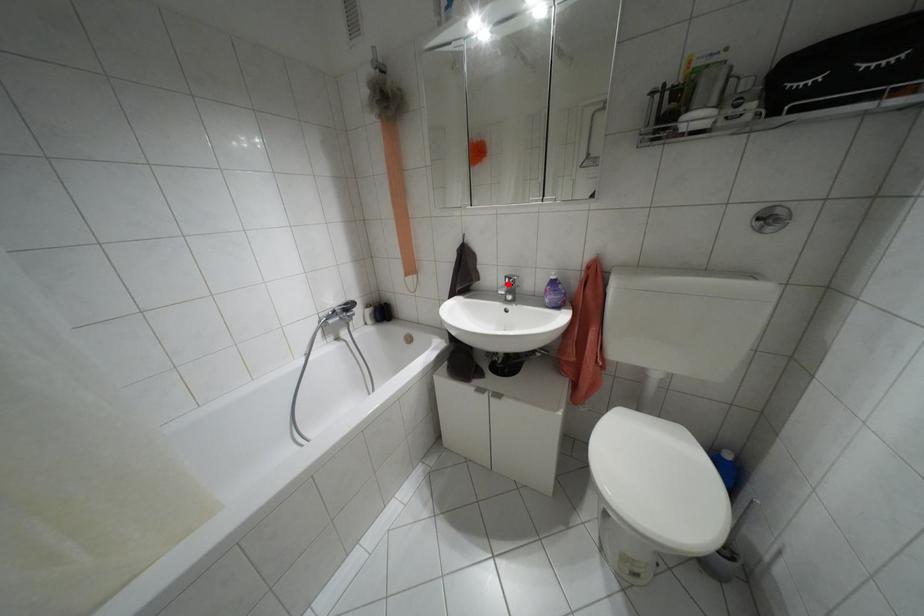
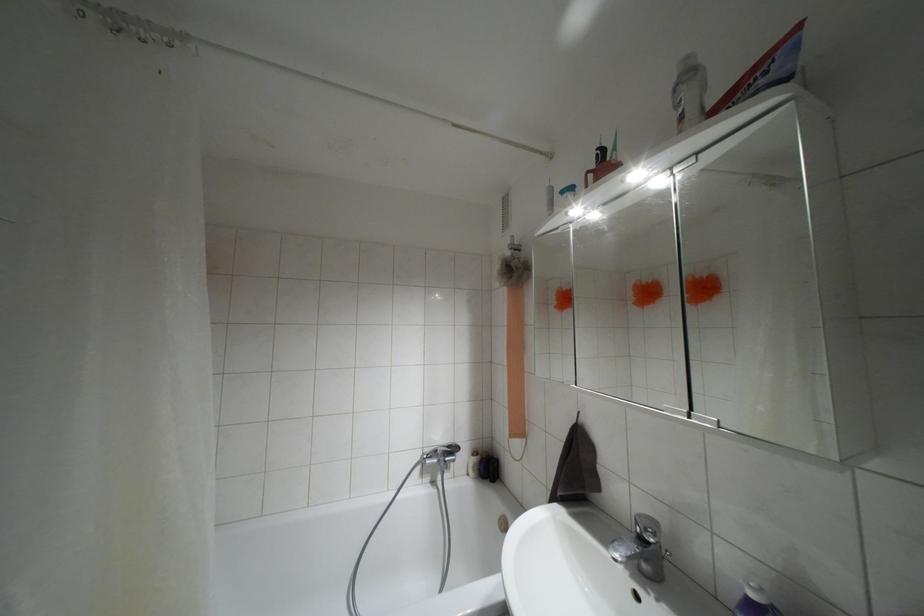
Locate, in the second image, the point that corresponds to the highlighted location in the first image.

(641, 538)